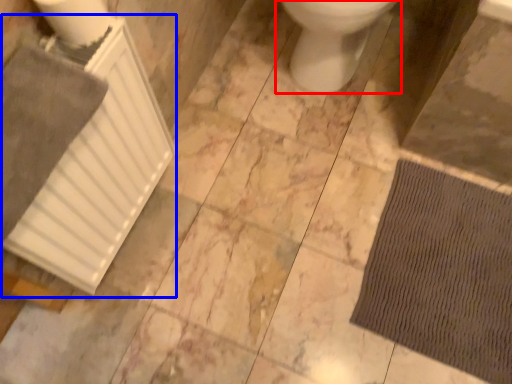
Question: Which object is closer to the camera taking this photo, toilet (highlighted by a red box) or radiator (highlighted by a blue box)?

Choices:
 (A) toilet
 (B) radiator

Answer: (B)